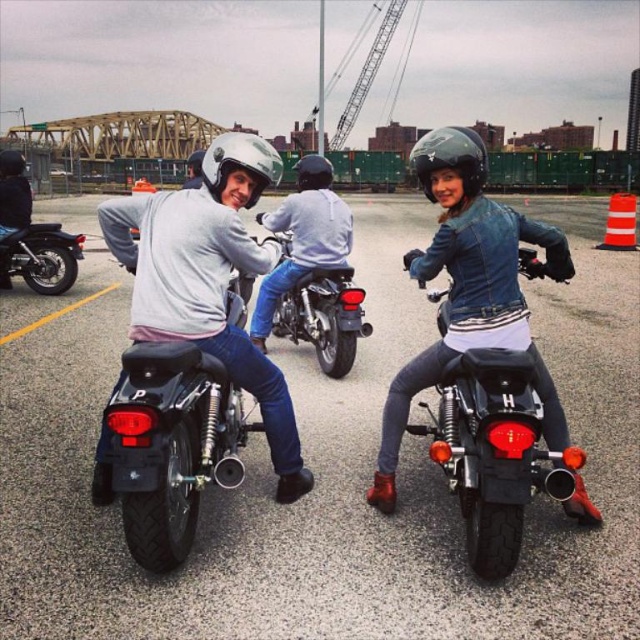
Does shiny black motorcycle at center have a lesser height compared to shiny chrome motorcycle at left?

In fact, shiny black motorcycle at center may be taller than shiny chrome motorcycle at left.

Who is higher up, shiny black motorcycle at center or shiny chrome motorcycle at left?

shiny chrome motorcycle at left

Who is more distant from viewer, (x=492, y=365) or (x=65, y=273)?

The point (x=65, y=273) is more distant.

Locate an element on the screen. This screenshot has width=640, height=640. shiny black motorcycle at center is located at coordinates (493, 451).

How much distance is there between denim jacket at center and shiny black motorcycle at center?

denim jacket at center and shiny black motorcycle at center are 35.20 inches apart.

Is point (394, 378) closer to camera compared to point (522, 426)?

No, (394, 378) is behind (522, 426).

I want to click on denim jacket at center, so click(468, 288).

Locate an element on the screen. Image resolution: width=640 pixels, height=640 pixels. denim jacket at center is located at coordinates (468, 288).

Who is higher up, glossy black helmet at center or matte white helmet at upper center?

Positioned higher is glossy black helmet at center.

Is glossy black helmet at center wider than matte white helmet at upper center?

Yes, glossy black helmet at center is wider than matte white helmet at upper center.

Identify the location of glossy black helmet at center. (451, 157).